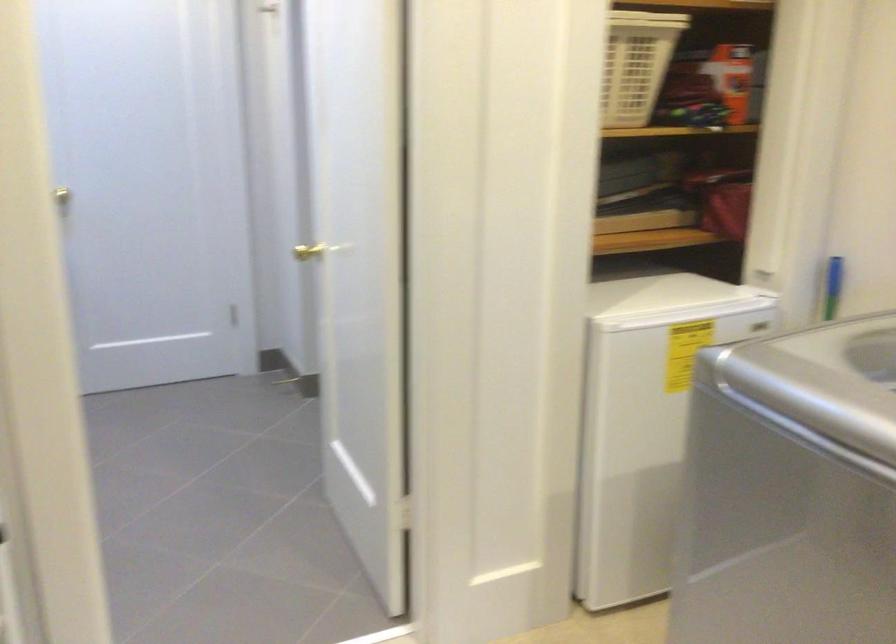
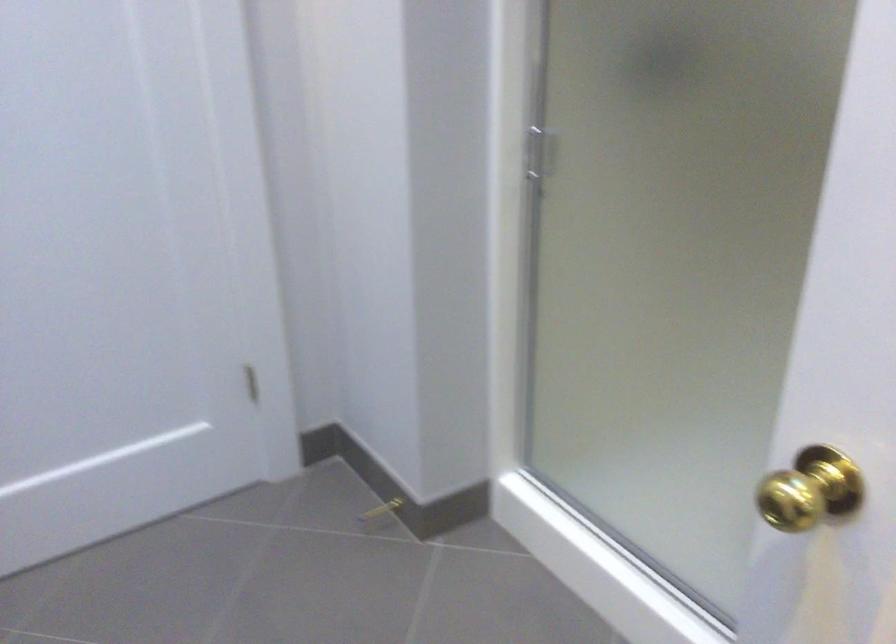
What movement of the cameraman would produce the second image?

The cameraman walked toward left, forward.